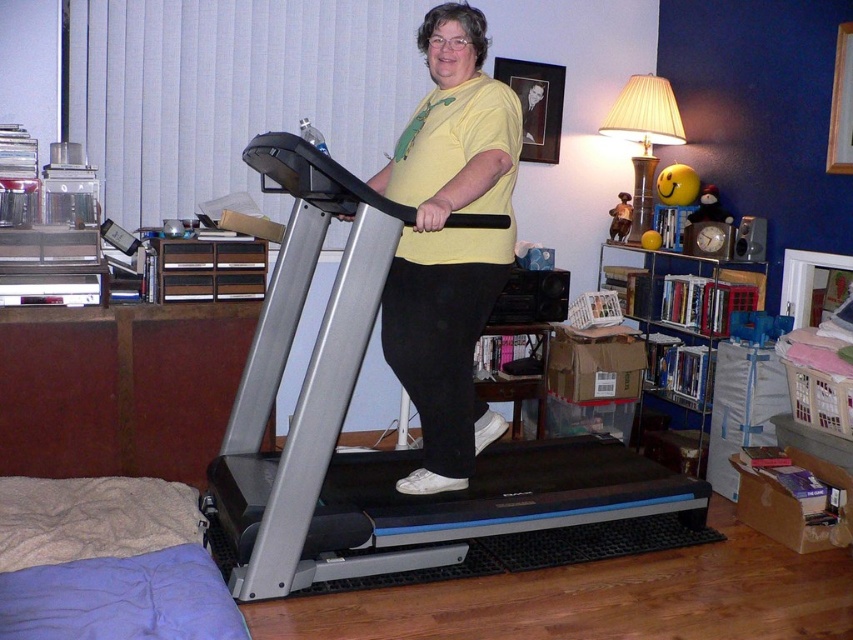
Based on the photo, you are trying to locate the silver metallic treadmill at center in the room. According to the coordinates provided, where would you find it?

The silver metallic treadmill at center is located at point (379, 451).

You are trying to decide where to place a new plant stand. The silver metallic treadmill at center and the metallic silver bookshelf at right are in the room. Which object is closer to the floor?

The silver metallic treadmill at center is closer to the floor because it is positioned below the metallic silver bookshelf at right.